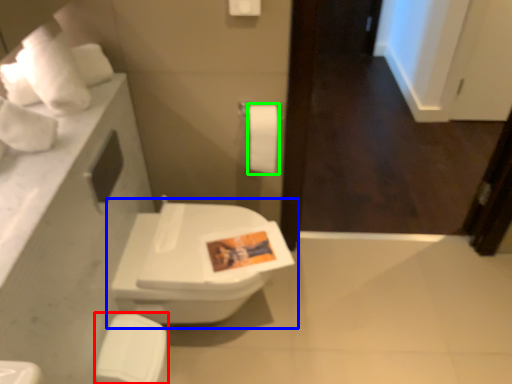
Question: Which is farther away from porcelain (highlighted by a red box)? toilet (highlighted by a blue box) or toilet paper (highlighted by a green box)?

Choices:
 (A) toilet
 (B) toilet paper

Answer: (B)